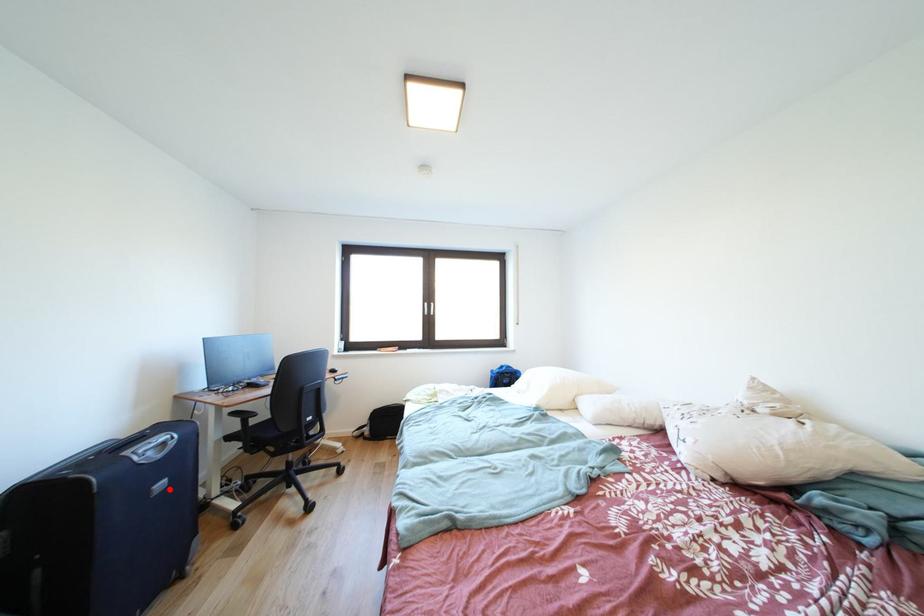
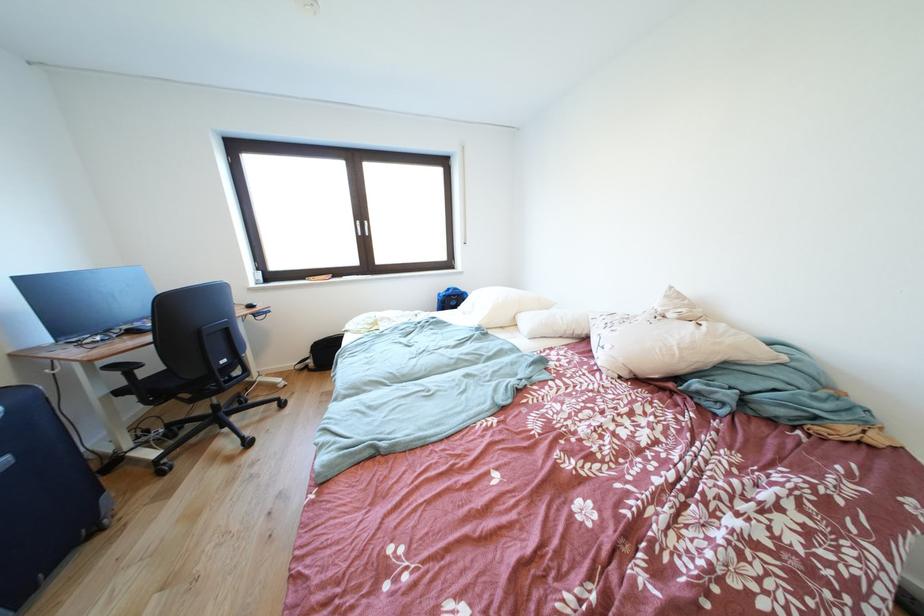
Where in the second image is the point corresponding to the highlighted location from the first image?

(8, 468)